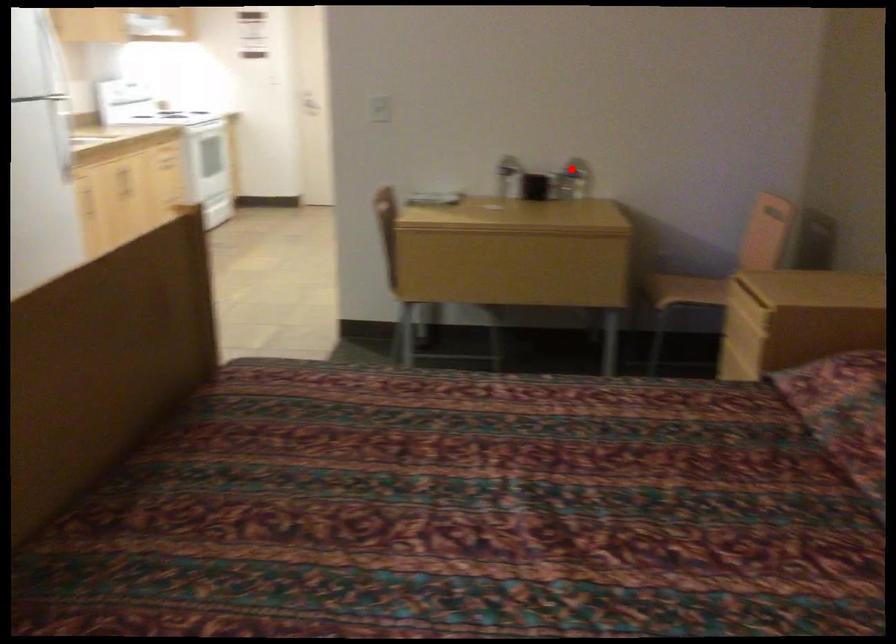
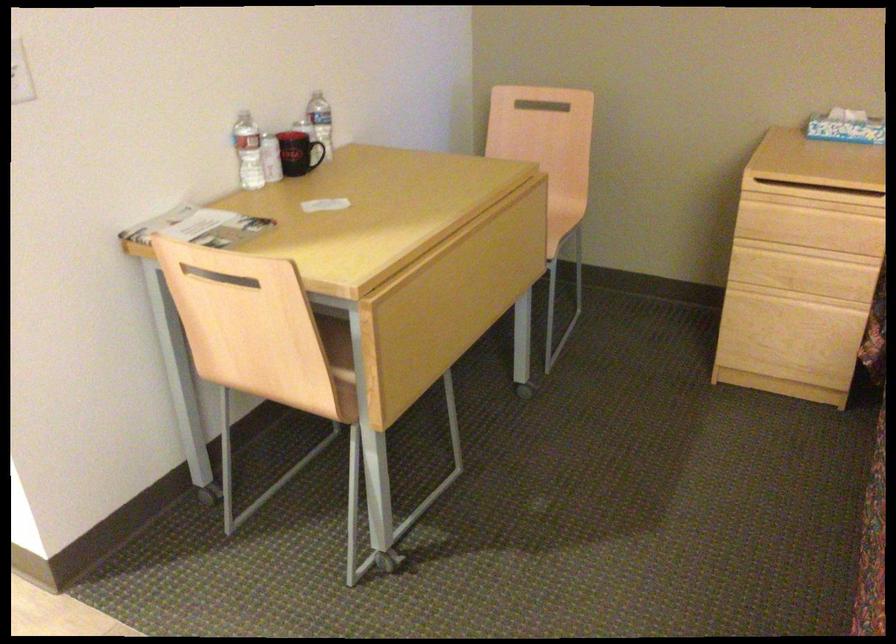
Question: I am providing you with two images of the same scene from different viewpoints. Image1 has a red point marked. In image2, the corresponding 3D location appears at what relative position? Reply with the corresponding letter.

Choices:
 (A) Closer
 (B) Farther

Answer: (A)